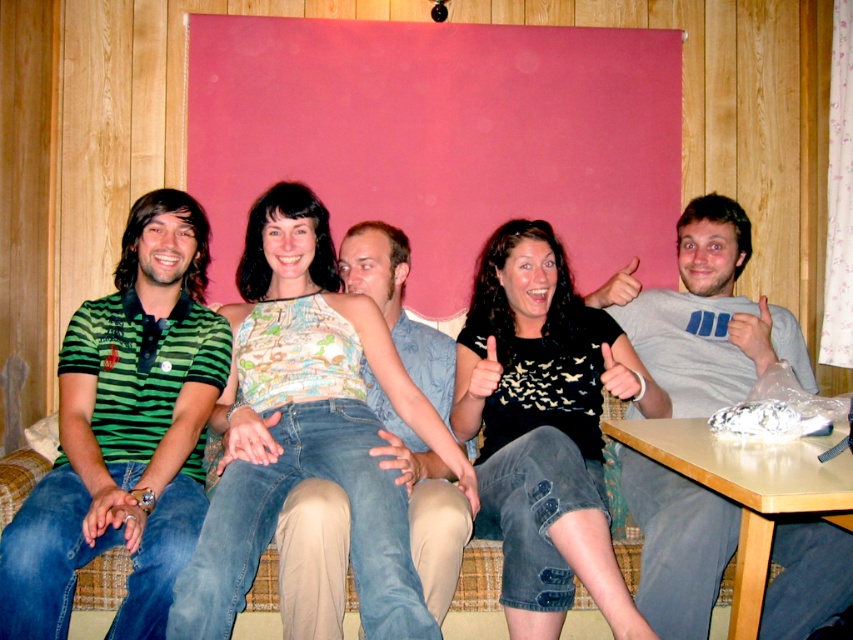
Does point (270, 536) lie in front of point (10, 550)?

No, it is not.

Who is shorter, patterned fabric top at center or green striped polo shirt at left?

patterned fabric top at center is shorter.

Identify the location of patterned fabric top at center. (306, 428).

Is patterned fabric top at center shorter than gray cotton shirt at center?

Indeed, patterned fabric top at center has a lesser height compared to gray cotton shirt at center.

Is point (311, 323) in front of point (842, 588)?

No, (311, 323) is further to viewer.

Locate an element on the screen. patterned fabric top at center is located at coordinates tap(306, 428).

Which of these two, green striped polo shirt at left or black matte shirt at center, stands shorter?

black matte shirt at center is shorter.

Can you confirm if green striped polo shirt at left is positioned to the left of black matte shirt at center?

Yes, green striped polo shirt at left is to the left of black matte shirt at center.

Is point (151, 230) in front of point (596, 579)?

No, (151, 230) is behind (596, 579).

The width and height of the screenshot is (853, 640). Find the location of `green striped polo shirt at left`. green striped polo shirt at left is located at coordinates (125, 433).